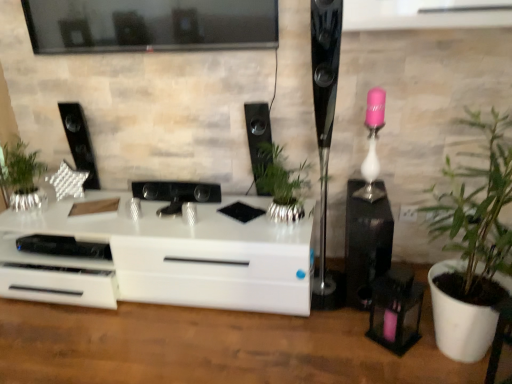
Identify the location of vacant area that lies to the right of black textured speaker at left, the 1th speaker viewed from the left. The width and height of the screenshot is (512, 384). (111, 191).